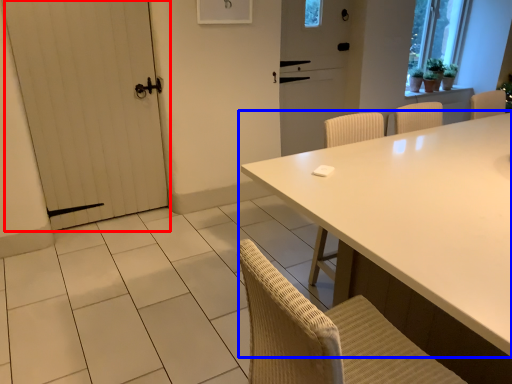
Question: Which of the following is the farthest to the observer, door (highlighted by a red box) or table (highlighted by a blue box)?

Choices:
 (A) door
 (B) table

Answer: (A)